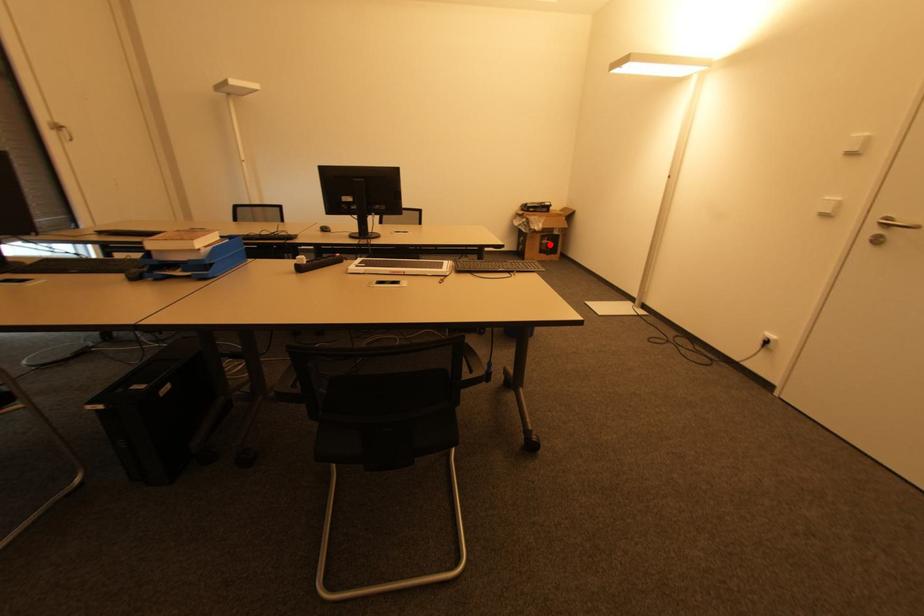
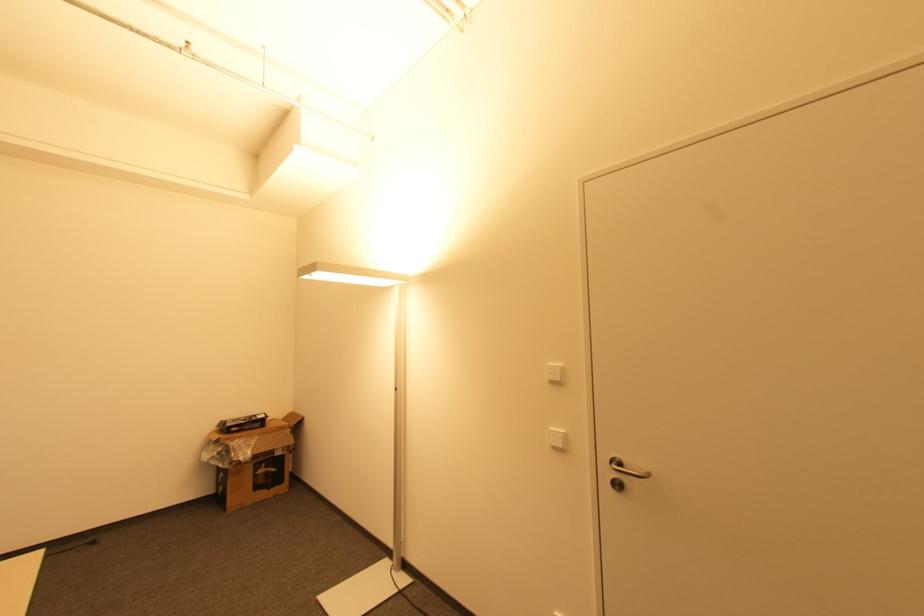
Question: I am providing you with two images of the same scene from different viewpoints. In image1, a red point is highlighted. Considering the same 3D point in image2, which of the following is correct?

Choices:
 (A) It is closer
 (B) It is farther

Answer: (B)